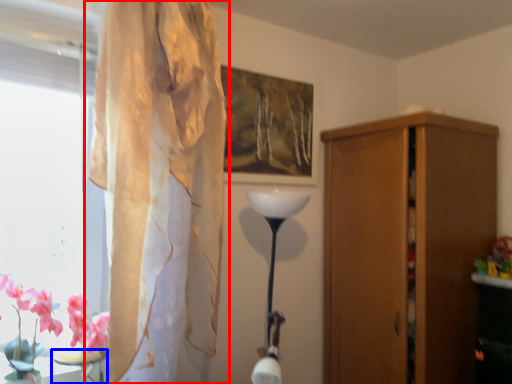
Question: Which point is further to the camera, curtain (highlighted by a red box) or table (highlighted by a blue box)?

Choices:
 (A) curtain
 (B) table

Answer: (B)